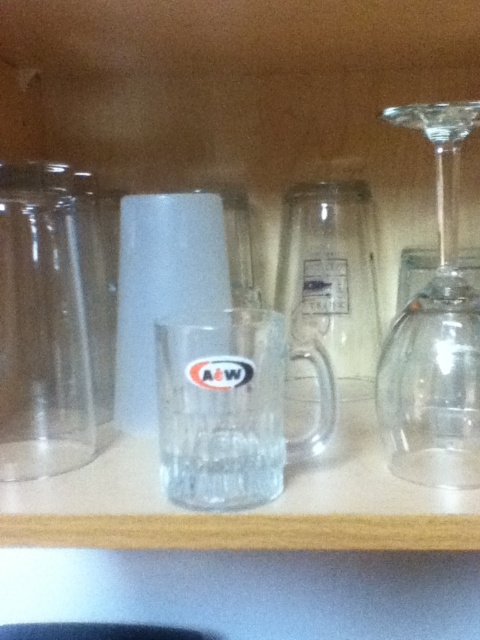
Question: Which of the following is the farthest from the observer?

Choices:
 (A) transparent glass wine glass at right
 (B) transparent glass vase at left

Answer: (B)

Question: Which object is closer to the camera taking this photo?

Choices:
 (A) transparent glass vase at left
 (B) transparent glass wine glass at right

Answer: (B)

Question: Can you confirm if transparent glass vase at left is positioned to the right of transparent glass wine glass at right?

Choices:
 (A) yes
 (B) no

Answer: (B)

Question: Is transparent glass vase at left to the left of transparent glass wine glass at right from the viewer's perspective?

Choices:
 (A) no
 (B) yes

Answer: (B)

Question: Is transparent glass vase at left positioned before transparent glass wine glass at right?

Choices:
 (A) yes
 (B) no

Answer: (B)